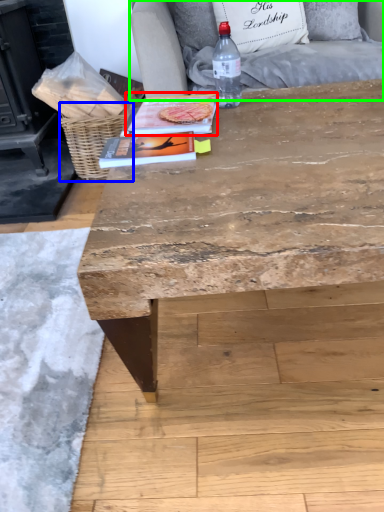
Question: Which object is the farthest from magazine (highlighted by a red box)? Choose among these: basket (highlighted by a blue box) or armchair (highlighted by a green box).

Choices:
 (A) basket
 (B) armchair

Answer: (A)